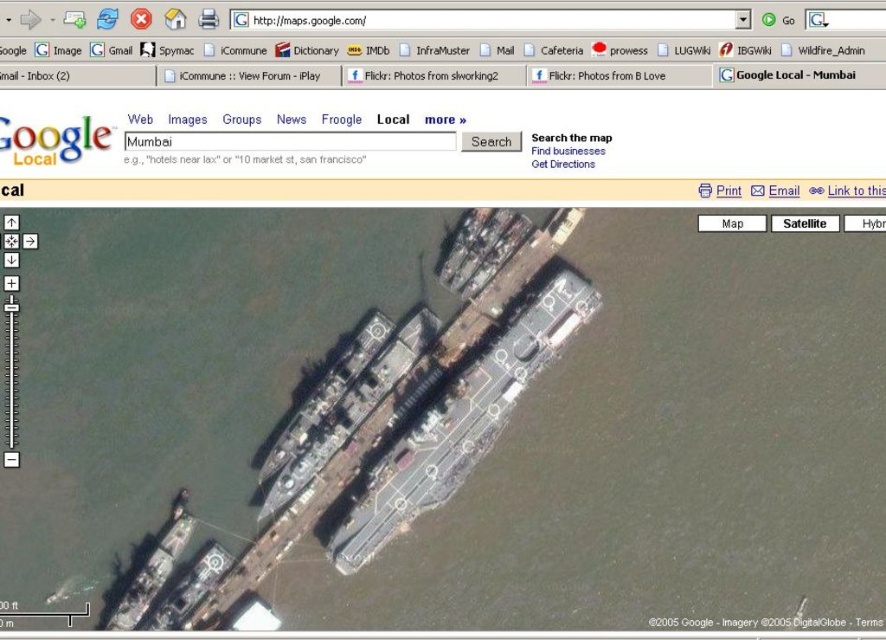
You are a delivery drone with a wingspan of 1.2 meters. You need to fly from the gray water at center to the dark gray metallic aircraft carrier at center. Is there enough space between them for your drone to pass through?

The distance between the gray water at center and the dark gray metallic aircraft carrier at center is 14.41 meters, which is more than enough for your drone with a 1.2 meter wingspan to pass through safely.

You are a ship inspector reviewing a satellite image of a naval shipyard. You notice two boats labeled as dark gray metallic boat at lower left and metallic gray boat at lower left. Which boat is located closer to the bottom of the image?

The dark gray metallic boat at lower left is positioned over the metallic gray boat at lower left, meaning it is closer to the bottom of the image.

You are a drone operator tasked with capturing aerial footage of the gray water at center and the dark gray metallic aircraft carrier at center. From the perspective of the drone, which object is located to the left?

The gray water at center is positioned on the left side of the dark gray metallic aircraft carrier at center, so from the drone operator perspective, the gray water at center is located to the left of the dark gray metallic aircraft carrier at center.